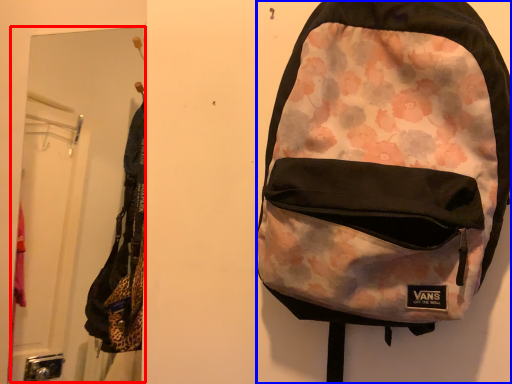
Question: Which object appears closest to the camera in this image, mirror (highlighted by a red box) or backpack (highlighted by a blue box)?

Choices:
 (A) mirror
 (B) backpack

Answer: (B)